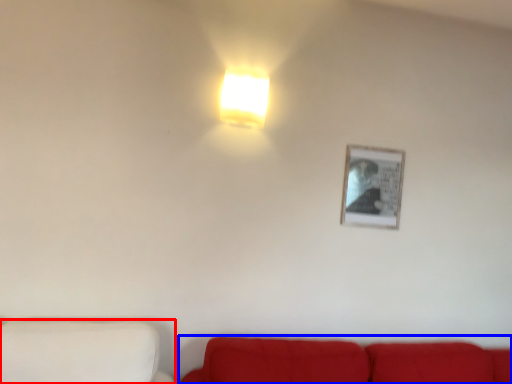
Question: Which object appears farthest to the camera in this image, furniture (highlighted by a red box) or studio couch (highlighted by a blue box)?

Choices:
 (A) furniture
 (B) studio couch

Answer: (B)